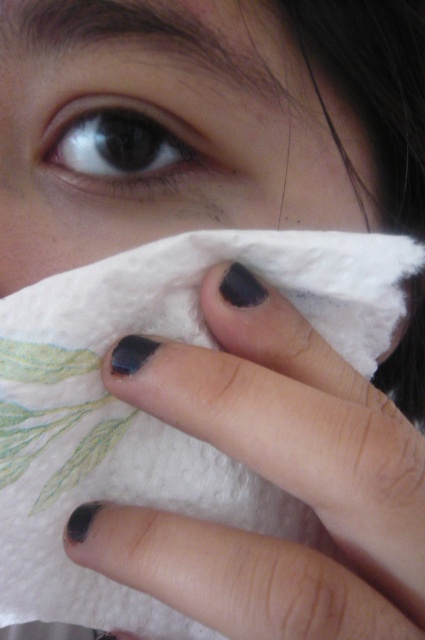
Question: Can you confirm if dark matte nail polish at center is bigger than black matte eye at upper left?

Choices:
 (A) yes
 (B) no

Answer: (A)

Question: Which of the following is the farthest from the observer?

Choices:
 (A) black matte eye at upper left
 (B) white paper towel at lower center

Answer: (A)

Question: Where is white paper towel at lower center located in relation to black matte eye at upper left in the image?

Choices:
 (A) right
 (B) left

Answer: (A)

Question: Does white paper towel at lower center have a smaller size compared to black matte eye at upper left?

Choices:
 (A) yes
 (B) no

Answer: (B)

Question: Which point is farther to the camera?

Choices:
 (A) (337, 381)
 (B) (294, 208)
 (C) (136, 131)

Answer: (B)

Question: Which of the following is the closest to the observer?

Choices:
 (A) dark matte nail polish at center
 (B) white paper towel at lower center
 (C) black matte eye at upper left

Answer: (A)